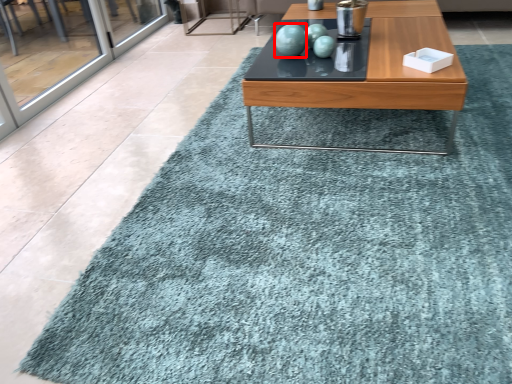
Question: From the image's perspective, what is the correct spatial positioning of turquoise (annotated by the red box) in reference to coffee table?

Choices:
 (A) above
 (B) below

Answer: (A)